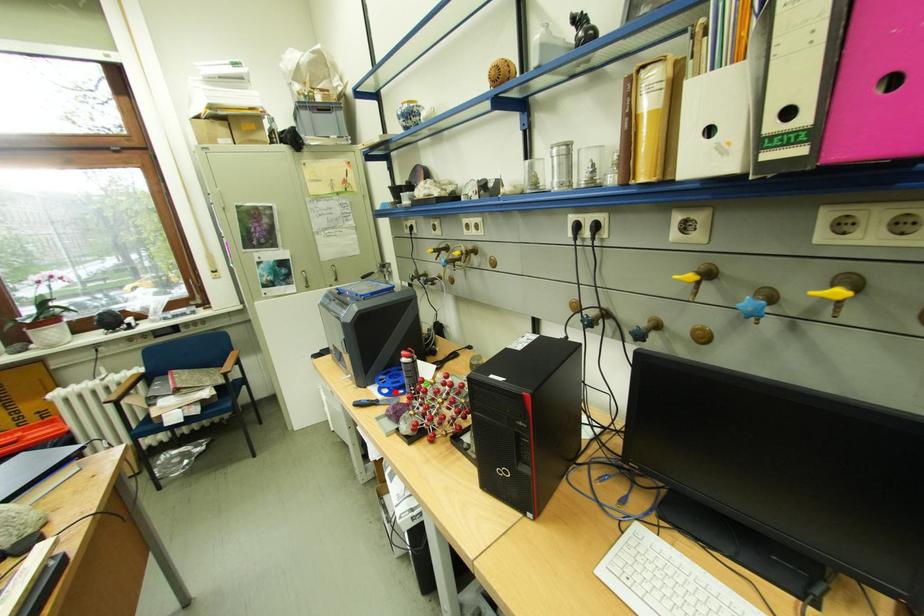
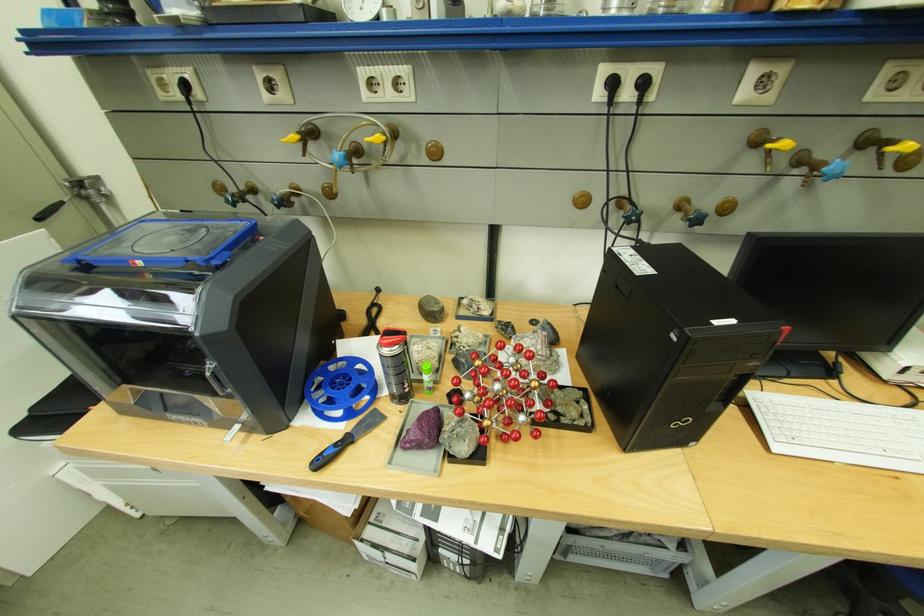
Locate, in the second image, the point that corresponds to the highlighted location in the first image.

(349, 413)